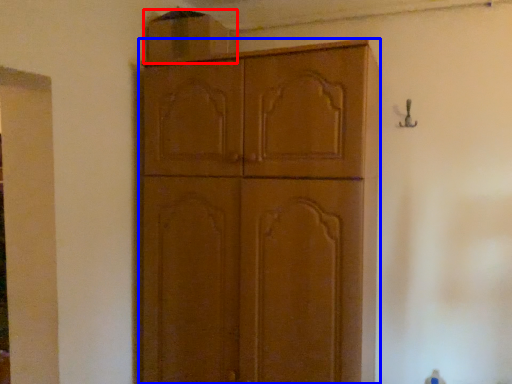
Question: Which of the following is the closest to the observer, cabinetry (highlighted by a red box) or cabinetry (highlighted by a blue box)?

Choices:
 (A) cabinetry
 (B) cabinetry

Answer: (B)